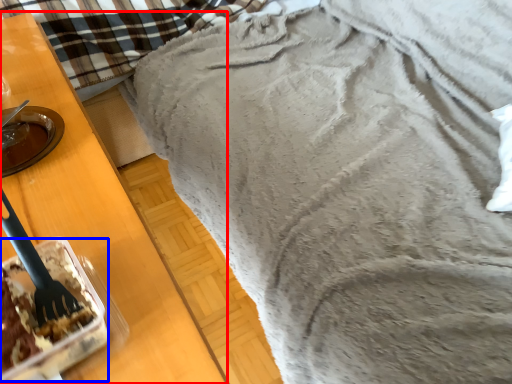
Question: Among these objects, which one is farthest to the camera, furniture (highlighted by a red box) or dessert (highlighted by a blue box)?

Choices:
 (A) furniture
 (B) dessert

Answer: (B)